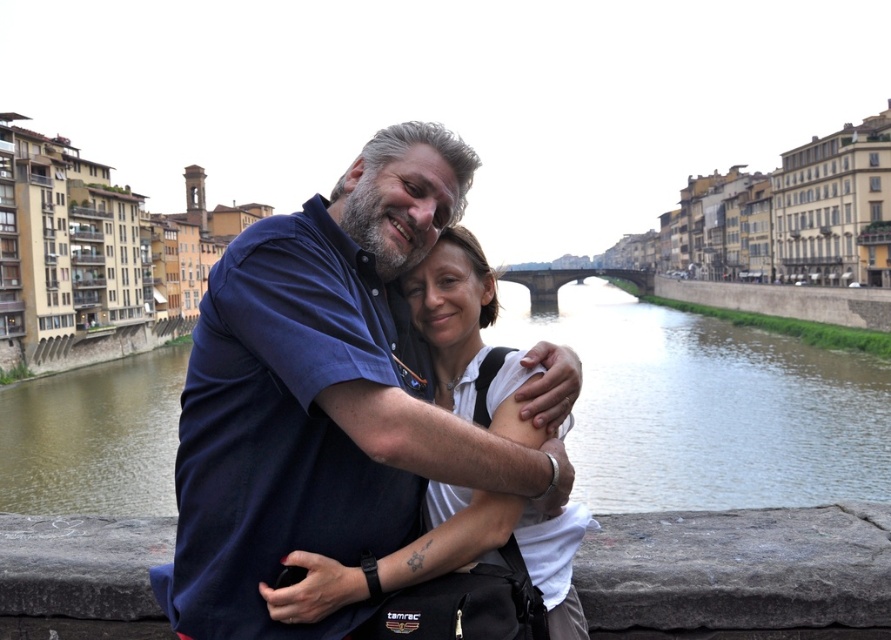
Between blue cotton shirt at center and brown water at center, which one appears on the left side from the viewer's perspective?

blue cotton shirt at center

Who is more distant from viewer, (399, 456) or (836, 456)?

Point (836, 456)

Which is behind, point (334, 440) or point (779, 481)?

Positioned behind is point (779, 481).

Identify the location of blue cotton shirt at center. This screenshot has width=891, height=640. (324, 396).

Is brown water at center taller than white matte shirt at center?

Correct, brown water at center is much taller as white matte shirt at center.

The width and height of the screenshot is (891, 640). Identify the location of brown water at center. (708, 406).

Who is more forward, (x=844, y=408) or (x=462, y=330)?

Point (x=462, y=330) is in front.

You are a GUI agent. You are given a task and a screenshot of the screen. Output one action in this format:
    pyautogui.click(x=<x>, y=<y>)
    Task: Click on the brown water at center
    
    Given the screenshot: What is the action you would take?
    708,406

Is point (308, 292) in front of point (446, 326)?

Yes, point (308, 292) is in front of point (446, 326).

Does blue cotton shirt at center have a larger size compared to white matte shirt at center?

Indeed, blue cotton shirt at center has a larger size compared to white matte shirt at center.

This screenshot has width=891, height=640. I want to click on blue cotton shirt at center, so click(324, 396).

This screenshot has height=640, width=891. I want to click on blue cotton shirt at center, so click(324, 396).